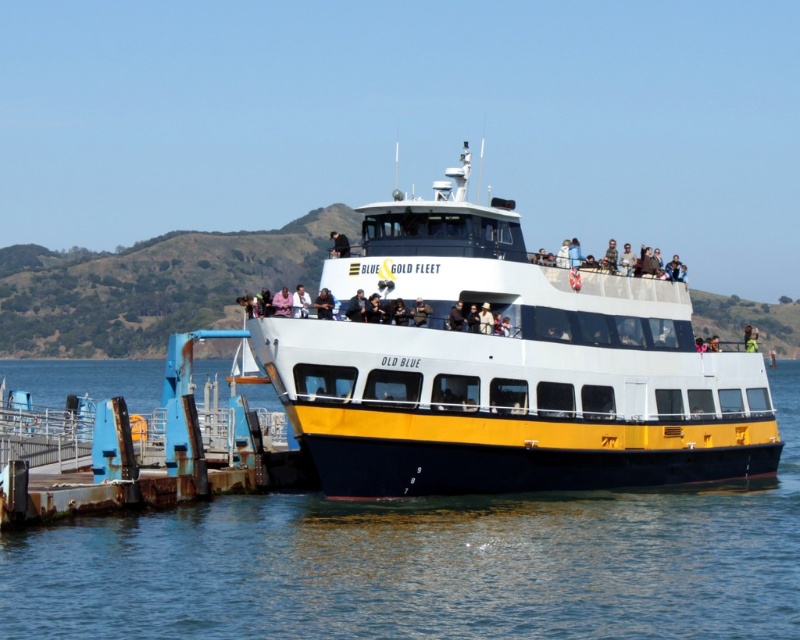
Question: Does yellow matte ferry at center have a smaller size compared to matte black jacket at upper center?

Choices:
 (A) no
 (B) yes

Answer: (A)

Question: Does yellow matte ferry at center have a lesser width compared to matte black jacket at upper center?

Choices:
 (A) yes
 (B) no

Answer: (B)

Question: Is blue water at lower left smaller than rusty metal dock at lower left?

Choices:
 (A) no
 (B) yes

Answer: (A)

Question: Which point is farther to the camera?

Choices:
 (A) matte black jacket at upper center
 (B) yellow matte ferry at center

Answer: (A)

Question: Among these points, which one is farthest from the camera?

Choices:
 (A) (197, 538)
 (B) (330, 236)
 (C) (622, 262)

Answer: (B)

Question: Which is nearer to the matte white people at upper center?

Choices:
 (A) blue water at lower left
 (B) matte black jacket at upper center

Answer: (A)